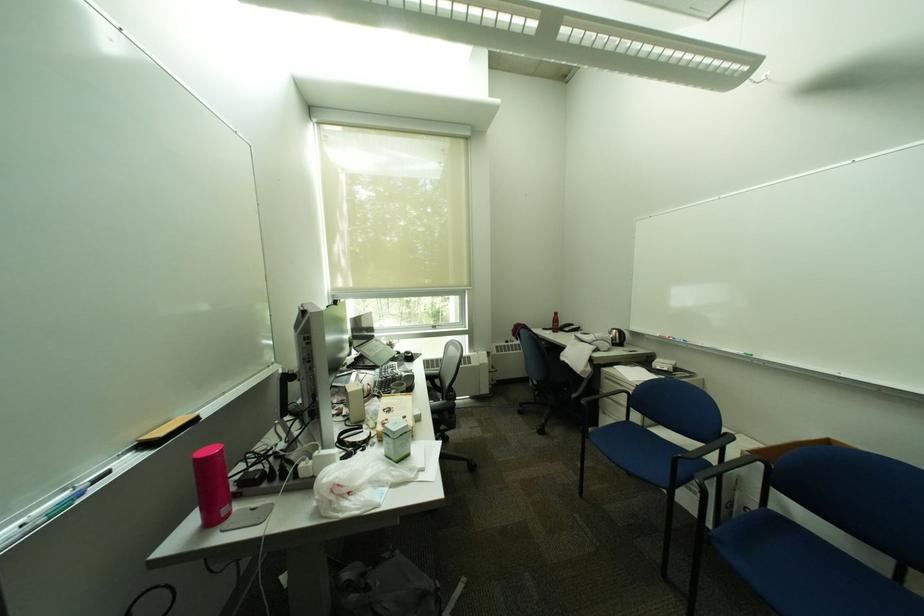
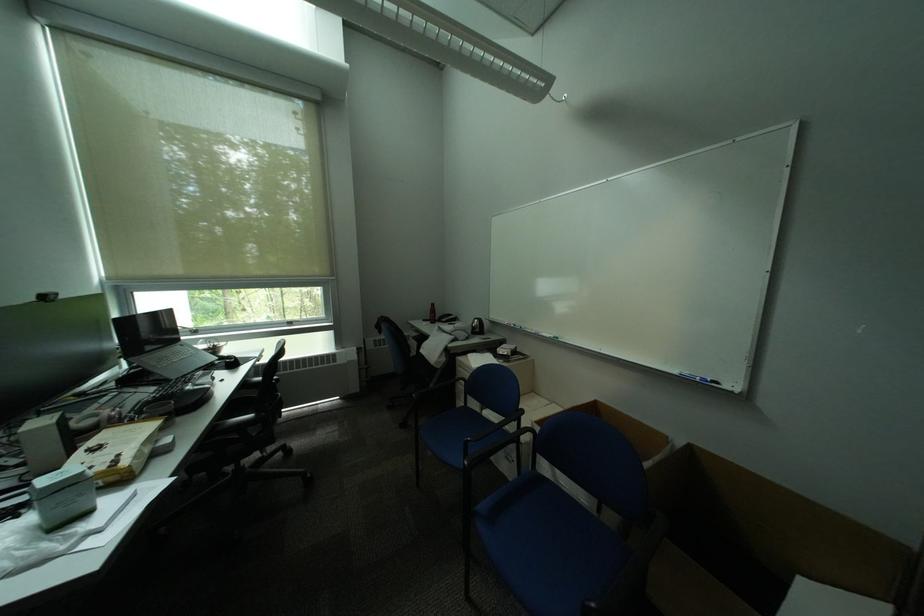
Question: The images are taken continuously from a first-person perspective. In which direction are you moving?

Choices:
 (A) Left
 (B) Right
 (C) Forward
 (D) Backward

Answer: (B)